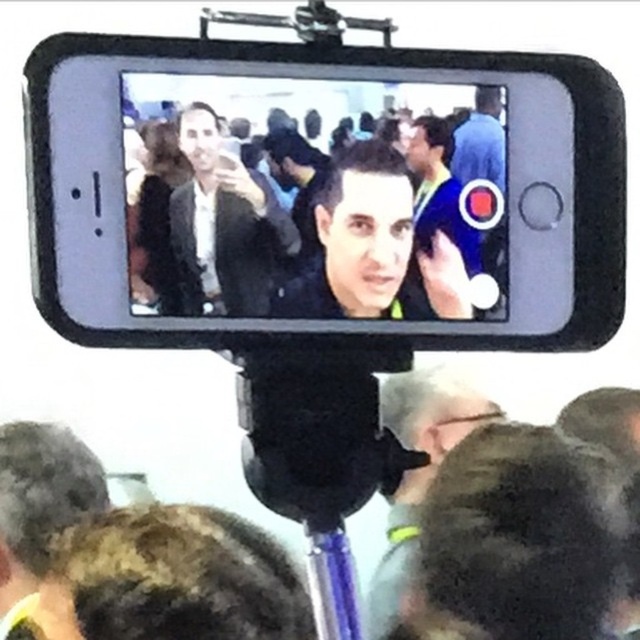
Question: Which point appears closest to the camera in this image?

Choices:
 (A) (52, 497)
 (B) (337, 168)
 (C) (467, 388)

Answer: (B)

Question: Is dark brown hair at lower left in front of dark gray fabric jacket at lower center?

Choices:
 (A) yes
 (B) no

Answer: (A)

Question: Does matte black phone at center come in front of dark brown hair at lower left?

Choices:
 (A) yes
 (B) no

Answer: (A)

Question: Considering the real-world distances, which object is closest to the matte black suit at center?

Choices:
 (A) dark brown hair at lower left
 (B) dark gray fabric jacket at lower center

Answer: (A)

Question: Observing the image, what is the correct spatial positioning of matte black suit at center in reference to dark gray fabric jacket at lower center?

Choices:
 (A) below
 (B) above

Answer: (B)

Question: Which point is farther from the camera taking this photo?

Choices:
 (A) (273, 259)
 (B) (403, 205)
 (C) (92, 472)
 (D) (394, 576)

Answer: (D)